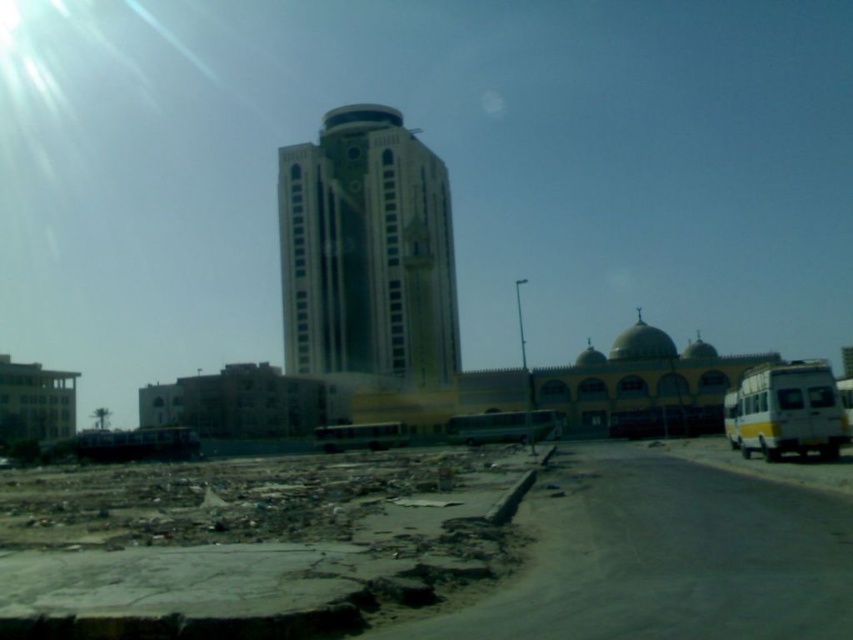
You are a photographer planning to capture the white glossy building at center and the green metallic bus at center in a single shot. Given that the camera can only focus on one object at a time, which object should you prioritize focusing on to ensure it appears sharp and clear in the final image?

The white glossy building at center is bigger than the green metallic bus at center, so you should prioritize focusing on the white glossy building at center to ensure it appears sharp and clear in the final image.

You are standing in the urban scene and want to take a photo of both the white glossy building at center and the yellow metallic bus at center. Which object should you position to the left side of your camera frame to include both in the photo?

You should position the white glossy building at center to the left side of your camera frame since it is already to the left of the yellow metallic bus at center in the scene.